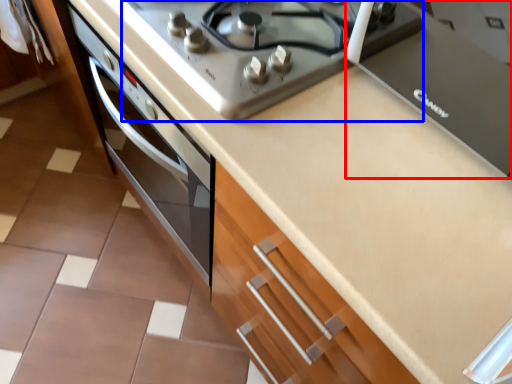
Question: Which point is further to the camera, appliance (highlighted by a red box) or gas stove (highlighted by a blue box)?

Choices:
 (A) appliance
 (B) gas stove

Answer: (B)